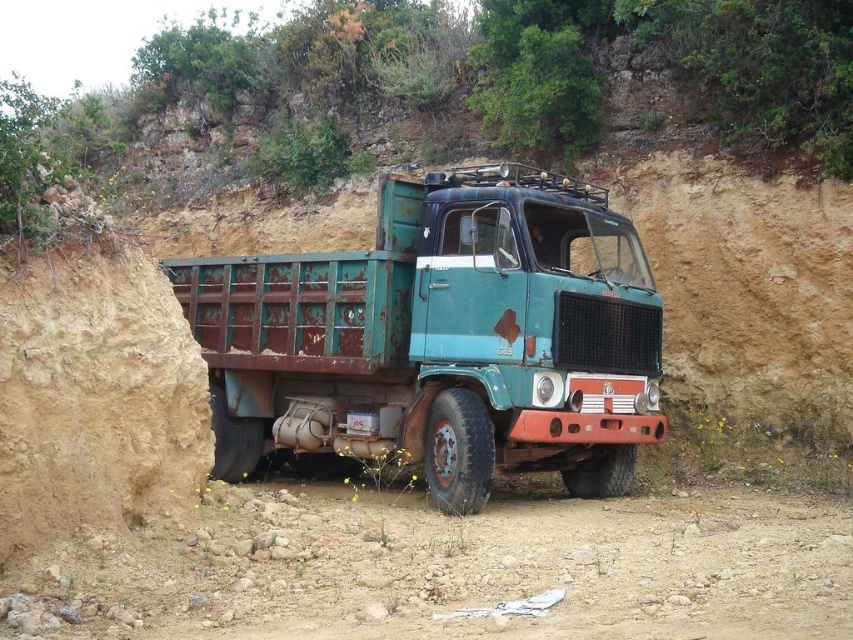
Question: Is rusty metal trailer truck at center thinner than brown dusty ground at lower center?

Choices:
 (A) no
 (B) yes

Answer: (A)

Question: Which object appears closest to the camera in this image?

Choices:
 (A) rusty metal trailer truck at center
 (B) brown dusty ground at lower center

Answer: (B)

Question: Which object appears closest to the camera in this image?

Choices:
 (A) brown dusty ground at lower center
 (B) rusty metal trailer truck at center

Answer: (A)

Question: Which object is farther from the camera taking this photo?

Choices:
 (A) rusty metal trailer truck at center
 (B) brown dusty ground at lower center

Answer: (A)

Question: Is rusty metal trailer truck at center above brown dusty ground at lower center?

Choices:
 (A) no
 (B) yes

Answer: (B)

Question: In this image, where is rusty metal trailer truck at center located relative to brown dusty ground at lower center?

Choices:
 (A) right
 (B) left

Answer: (A)